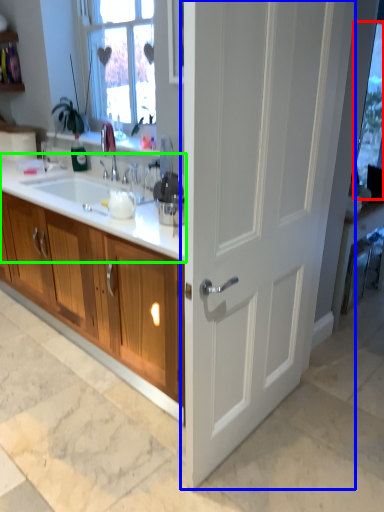
Question: Estimate the real-world distances between objects in this image. Which object is closer to window screen (highlighted by a red box), door (highlighted by a blue box) or countertop (highlighted by a green box)?

Choices:
 (A) door
 (B) countertop

Answer: (A)